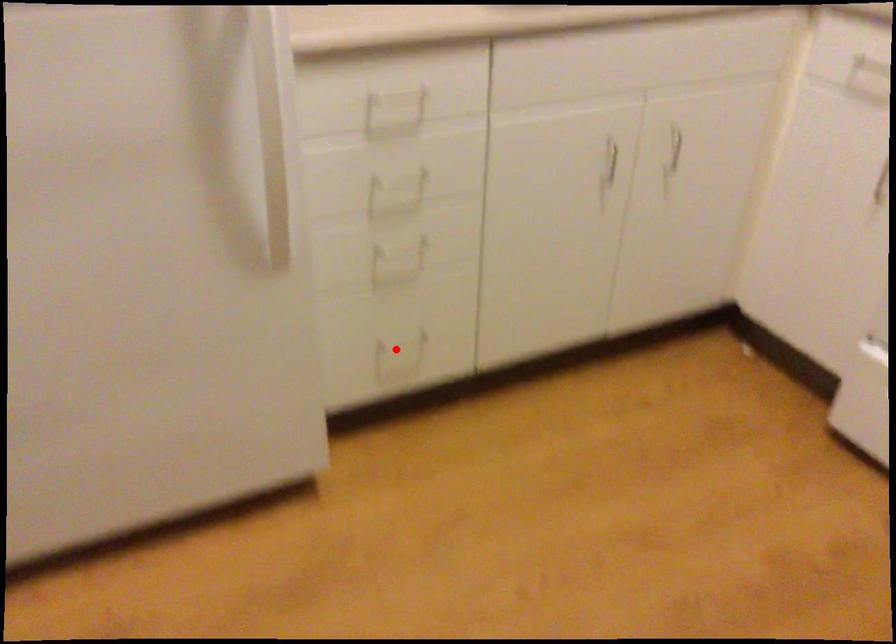
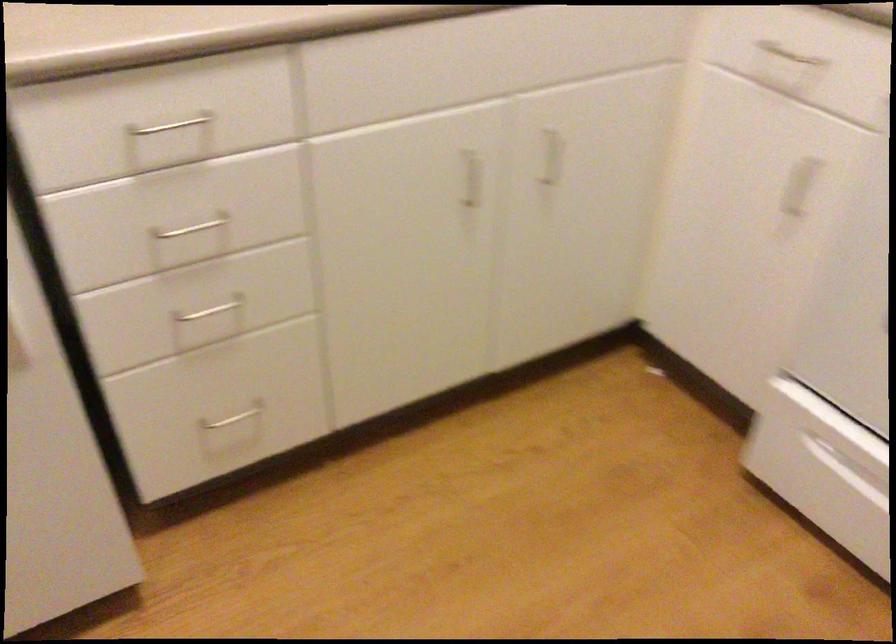
Question: I am providing you with two images of the same scene from different viewpoints. Given a red point in image1, look at the same physical point in image2. Is it:

Choices:
 (A) Closer to the viewpoint
 (B) Farther from the viewpoint

Answer: (A)